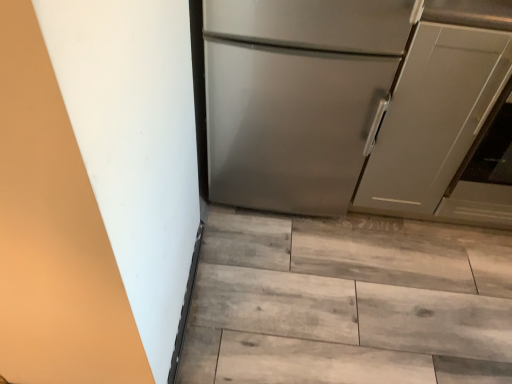
Question: Considering their positions, is matte gray cabinet at right located in front of or behind satin silver refrigerator at center?

Choices:
 (A) behind
 (B) front

Answer: (A)

Question: Is matte gray cabinet at right wider or thinner than satin silver refrigerator at center?

Choices:
 (A) wide
 (B) thin

Answer: (A)

Question: Based on their relative distances, which object is nearer to the satin silver refrigerator at center?

Choices:
 (A) wooden floor at lower center
 (B) matte gray cabinet at right

Answer: (B)

Question: Estimate the real-world distances between objects in this image. Which object is closer to the satin silver refrigerator at center?

Choices:
 (A) wooden floor at lower center
 (B) matte gray cabinet at right

Answer: (B)